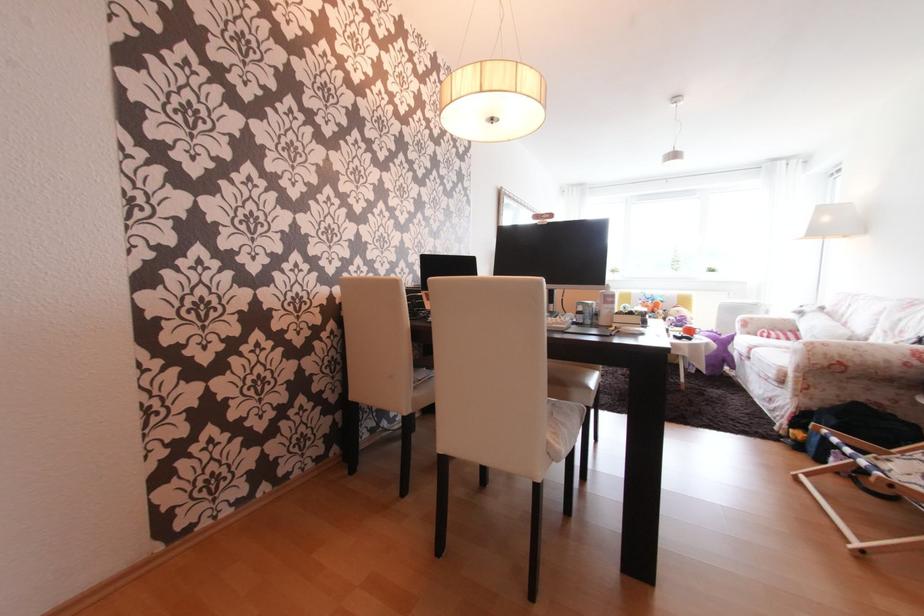
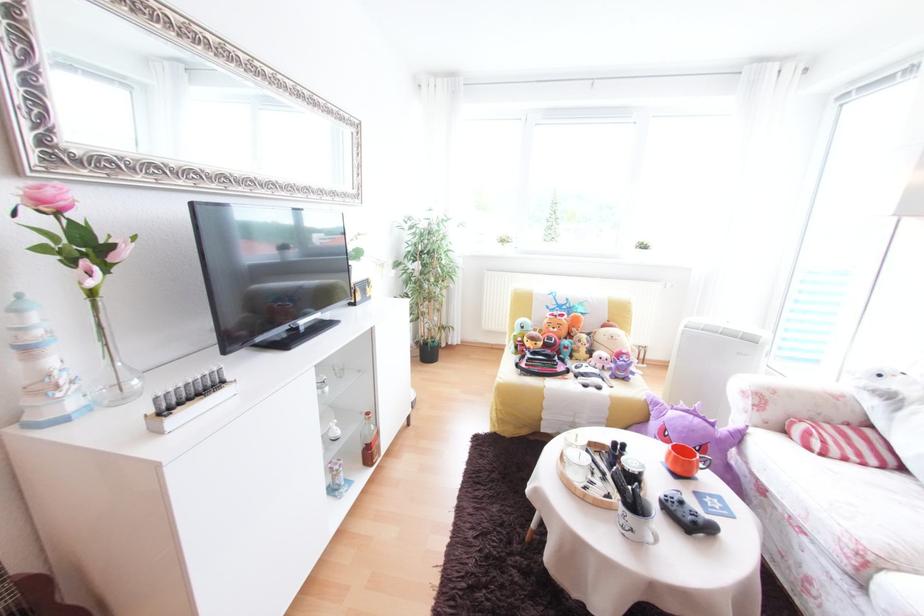
Where in the second image is the point corresponding to point 698,339 from the first image?

(719, 530)